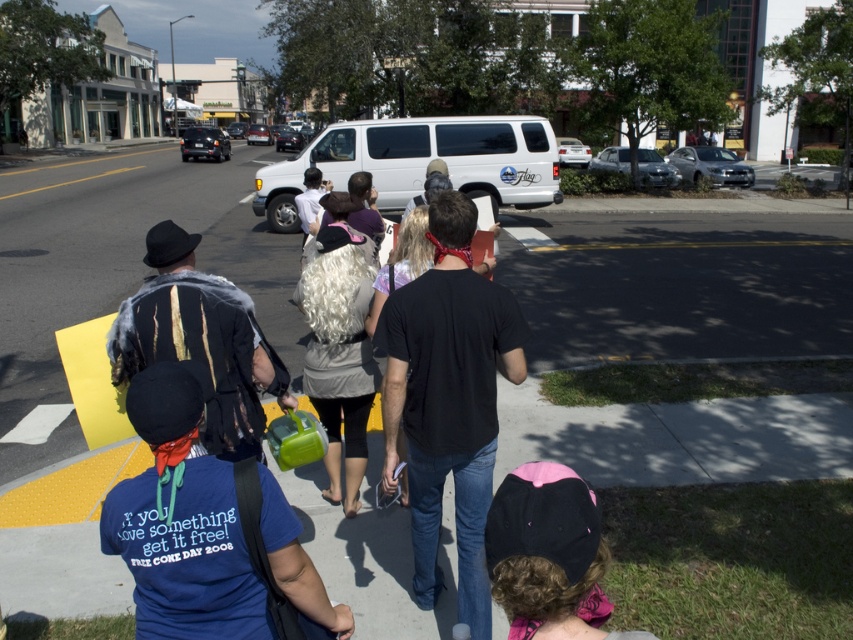
Question: Which is farther from the black fabric cap at lower right?

Choices:
 (A) shiny black sedan at center
 (B) black glossy van at center

Answer: (B)

Question: Observing the image, what is the correct spatial positioning of blue cotton t-shirt at center in reference to white matte van at center?

Choices:
 (A) left
 (B) right

Answer: (B)

Question: Does black matte t-shirt at center have a smaller size compared to white matte sedan at center?

Choices:
 (A) no
 (B) yes

Answer: (B)

Question: Can you confirm if white matte van at center is thinner than shiny black sedan at upper left?

Choices:
 (A) no
 (B) yes

Answer: (B)

Question: Which object is positioned farthest from the shiny black sedan at upper left?

Choices:
 (A) silver metallic sedan at right
 (B) black matte t-shirt at center
 (C) white matte van at center
 (D) fur coat at center

Answer: (D)

Question: Considering the real-world distances, which object is closest to the black fabric cap at lower right?

Choices:
 (A) silver metallic sedan at center
 (B) shiny silver van at center

Answer: (A)